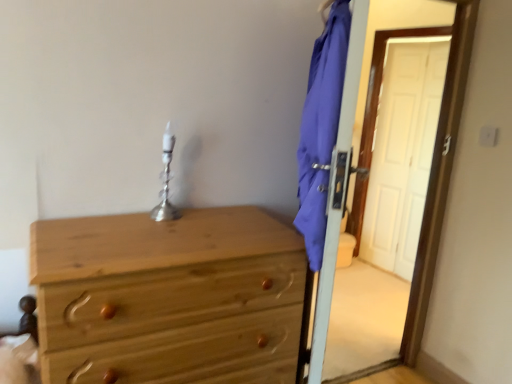
Image resolution: width=512 pixels, height=384 pixels. I want to click on natural wood chest of drawers at left, so click(x=154, y=283).

Locate an element on the screen. natural wood chest of drawers at left is located at coordinates (154, 283).

Consider the image. Is silver metallic table lamp at center bigger than blue fabric screen door at right?

Incorrect, silver metallic table lamp at center is not larger than blue fabric screen door at right.

Where is `table lamp behind the blue fabric screen door at right`? The height and width of the screenshot is (384, 512). table lamp behind the blue fabric screen door at right is located at coordinates (166, 182).

Is silver metallic table lamp at center aimed at blue fabric screen door at right?

No, silver metallic table lamp at center does not turn towards blue fabric screen door at right.

From a real-world perspective, which is physically below, natural wood chest of drawers at left or silver metallic table lamp at center?

In real-world perspective, natural wood chest of drawers at left is lower.

What's the angular difference between natural wood chest of drawers at left and silver metallic table lamp at center's facing directions?

The angular difference between natural wood chest of drawers at left and silver metallic table lamp at center is 2.81 degrees.

Are natural wood chest of drawers at left and silver metallic table lamp at center located far from each other?

No, natural wood chest of drawers at left is not far away from silver metallic table lamp at center.

Looking at this image, based on their sizes in the image, would you say natural wood chest of drawers at left is bigger or smaller than silver metallic table lamp at center?

In the image, natural wood chest of drawers at left appears to be larger than silver metallic table lamp at center.

From a real-world perspective, who is located higher, blue fabric screen door at right or silver metallic table lamp at center?

silver metallic table lamp at center is physically above.

Is blue fabric screen door at right further to the viewer compared to silver metallic table lamp at center?

No.

Looking at this image, is blue fabric screen door at right not near silver metallic table lamp at center?

That's right, there is a large distance between blue fabric screen door at right and silver metallic table lamp at center.

Does blue fabric screen door at right have a greater height compared to silver metallic table lamp at center?

Yes.

Does silver metallic table lamp at center contain natural wood chest of drawers at left?

No, natural wood chest of drawers at left is not inside silver metallic table lamp at center.

This screenshot has width=512, height=384. Find the location of `chest of drawers below the silver metallic table lamp at center (from the image's perspective)`. chest of drawers below the silver metallic table lamp at center (from the image's perspective) is located at coordinates (154, 283).

Does point (167, 210) appear closer or farther from the camera than point (214, 266)?

Clearly, point (167, 210) is more distant from the camera than point (214, 266).

What's the angular difference between silver metallic table lamp at center and natural wood chest of drawers at left's facing directions?

2.81 degrees.

Who is bigger, natural wood chest of drawers at left or blue fabric screen door at right?

Bigger between the two is natural wood chest of drawers at left.

Is the depth of natural wood chest of drawers at left less than that of blue fabric screen door at right?

Yes, natural wood chest of drawers at left is closer to the camera.

Which of these two, natural wood chest of drawers at left or blue fabric screen door at right, stands taller?

blue fabric screen door at right.

Does natural wood chest of drawers at left turn towards blue fabric screen door at right?

No, natural wood chest of drawers at left is not oriented towards blue fabric screen door at right.

Is blue fabric screen door at right oriented towards natural wood chest of drawers at left?

Yes, blue fabric screen door at right faces towards natural wood chest of drawers at left.

The image size is (512, 384). I want to click on chest of drawers lying on the left of blue fabric screen door at right, so click(154, 283).

Is blue fabric screen door at right placed right next to natural wood chest of drawers at left?

blue fabric screen door at right and natural wood chest of drawers at left are not in contact.

Which object is closer to the camera taking this photo, blue fabric screen door at right or natural wood chest of drawers at left?

natural wood chest of drawers at left.

Where is `table lamp that appears above the blue fabric screen door at right (from a real-world perspective)`? The height and width of the screenshot is (384, 512). table lamp that appears above the blue fabric screen door at right (from a real-world perspective) is located at coordinates (166, 182).

The width and height of the screenshot is (512, 384). I want to click on table lamp behind the natural wood chest of drawers at left, so click(x=166, y=182).

Which object lies further to the anchor point blue fabric screen door at right, natural wood chest of drawers at left or silver metallic table lamp at center?

natural wood chest of drawers at left is positioned further to the anchor blue fabric screen door at right.

When comparing their distances from blue fabric screen door at right, does silver metallic table lamp at center or natural wood chest of drawers at left seem closer?

Among the two, silver metallic table lamp at center is located nearer to blue fabric screen door at right.

Which object lies nearer to the anchor point silver metallic table lamp at center, natural wood chest of drawers at left or blue fabric screen door at right?

natural wood chest of drawers at left is closer to silver metallic table lamp at center.

Looking at the image, which one is located closer to natural wood chest of drawers at left, silver metallic table lamp at center or blue fabric screen door at right?

silver metallic table lamp at center lies closer to natural wood chest of drawers at left than the other object.

Looking at the image, which one is located closer to silver metallic table lamp at center, blue fabric screen door at right or natural wood chest of drawers at left?

natural wood chest of drawers at left is positioned closer to the anchor silver metallic table lamp at center.

Considering their positions, is blue fabric screen door at right positioned closer to natural wood chest of drawers at left than silver metallic table lamp at center?

The object closer to natural wood chest of drawers at left is silver metallic table lamp at center.

Image resolution: width=512 pixels, height=384 pixels. Find the location of `the chest of drawers located between silver metallic table lamp at center and blue fabric screen door at right in the left-right direction`. the chest of drawers located between silver metallic table lamp at center and blue fabric screen door at right in the left-right direction is located at coordinates (154, 283).